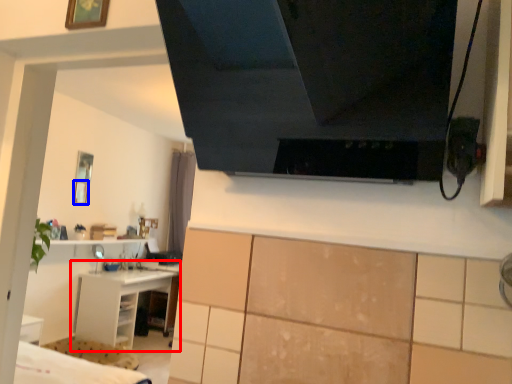
Question: Which point is further to the camera, shelf (highlighted by a red box) or picture frame (highlighted by a blue box)?

Choices:
 (A) shelf
 (B) picture frame

Answer: (B)